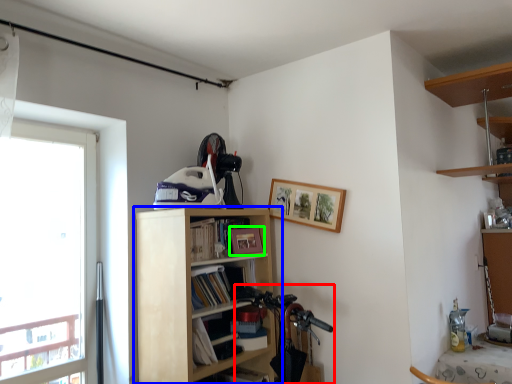
Question: Which is farther away from mountain bike (highlighted by a red box)? shelf (highlighted by a blue box) or picture frame (highlighted by a green box)?

Choices:
 (A) shelf
 (B) picture frame

Answer: (B)